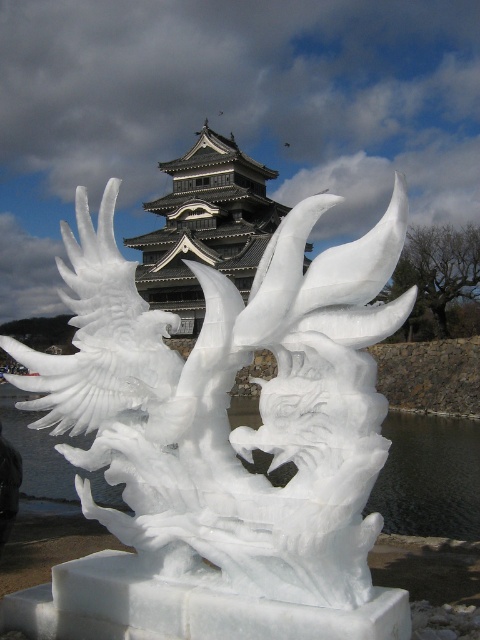
You are a tour guide leading a group to the dark gray stone tower at center. You notice the white ice sculpture at center is in the way. Can you walk around it to reach the tower?

The white ice sculpture at center is 45.00 meters away from the dark gray stone tower at center, so you can walk around the white ice sculpture at center to reach the tower.

Looking at this image, you are a photographer standing in front of the white ice sculpture at center and the dark gray stone tower at center. You want to capture a photo where the ice sculpture is clearly visible without the tower blocking it. Is the current position suitable?

The white ice sculpture at center is in front of the dark gray stone tower at center, so the current position is suitable as the ice sculpture will block the tower in the photo, making it clearly visible without the tower blocking it.

You are an architect planning to place a new statue in the courtyard between the white ice sculpture at center and the dark gray stone tower at center. The statue must be placed closer to the thinner object. Which object should the statue be placed near?

The white ice sculpture at center is thinner than the dark gray stone tower at center, so the statue should be placed near the white ice sculpture at center.